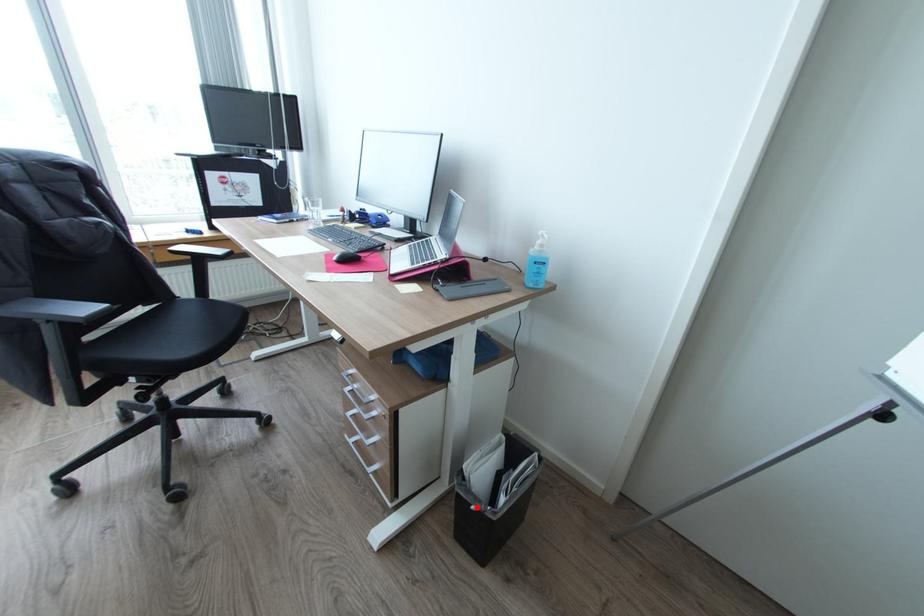
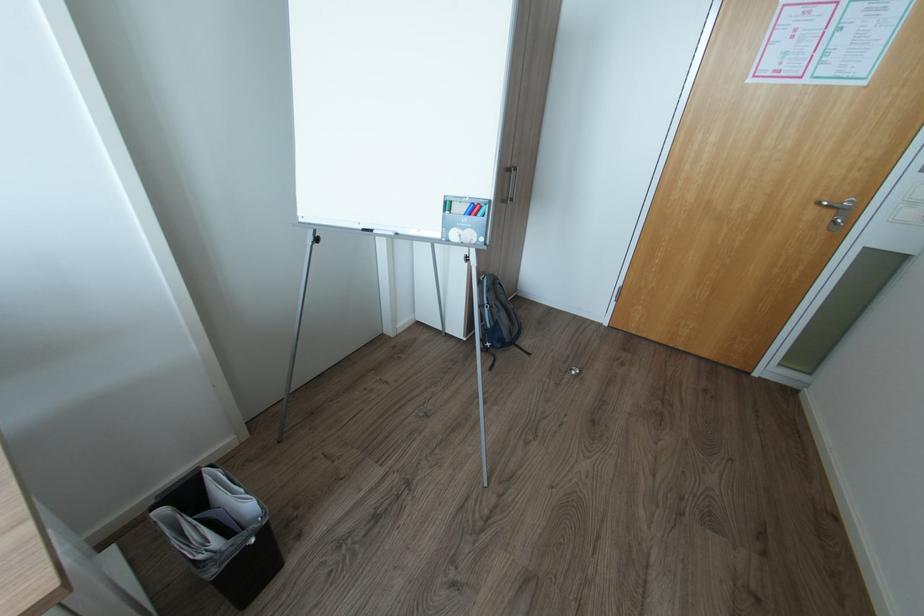
Where in the second image is the point corresponding to the highlighted location from the first image?

(257, 541)